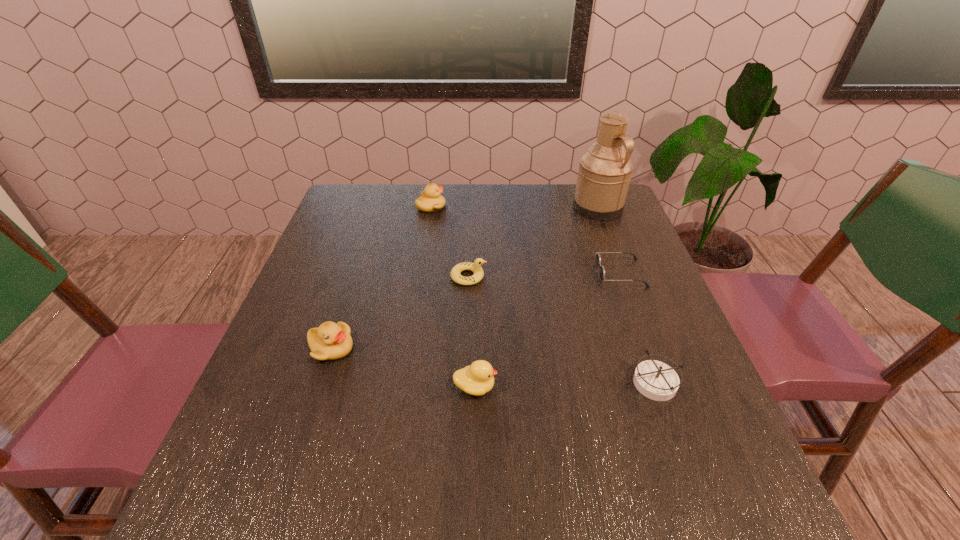
The width and height of the screenshot is (960, 540). I want to click on blank area located 0.090m on the beak of the farthest duckling, so click(x=475, y=207).

This screenshot has width=960, height=540. Identify the location of free spot located 0.180m on the front-facing side of the third farthest duckling. (440, 348).

Where is `vacant space situated on the beak of the nearest duckling`? The width and height of the screenshot is (960, 540). vacant space situated on the beak of the nearest duckling is located at coordinates (534, 387).

The width and height of the screenshot is (960, 540). Find the location of `vacant point located 0.270m on the left of the compass`. vacant point located 0.270m on the left of the compass is located at coordinates (492, 382).

Identify the location of free space located 0.270m on the face of the second farthest duckling. (595, 276).

Locate an element on the screen. vacant space situated on the front-facing side of the shortest object is located at coordinates (521, 273).

What are the coordinates of `vacant area situated on the front-facing side of the shortest object` in the screenshot? It's located at [558, 273].

At what (x,y) coordinates should I click in order to perform the action: click on vacant area located 0.390m on the front-facing side of the shortest object. Please return your answer as a coordinate pair (x, y). The image size is (960, 540). Looking at the image, I should click on (442, 273).

The image size is (960, 540). Identify the location of pitcher at the far edge. (604, 173).

In order to click on duckling that is at the far edge in this screenshot , I will do `click(430, 200)`.